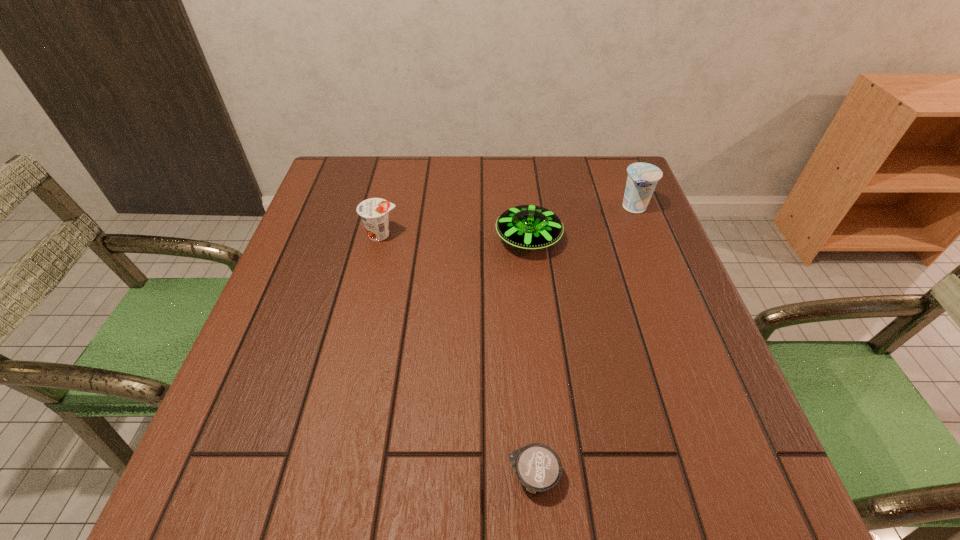
Where is `free location located on the back of the shortest object`? Image resolution: width=960 pixels, height=540 pixels. free location located on the back of the shortest object is located at coordinates coord(521,326).

Identify the location of object situated at the far edge. The width and height of the screenshot is (960, 540). (642, 179).

I want to click on object that is positioned at the near edge, so click(538, 467).

Image resolution: width=960 pixels, height=540 pixels. I want to click on object that is at the left edge, so click(x=374, y=212).

Locate an element on the screen. object that is at the right edge is located at coordinates (642, 179).

Locate an element on the screen. object that is at the far right corner is located at coordinates (642, 179).

In the image, there is a desktop. At what (x,y) coordinates should I click in order to perform the action: click on vacant area at the far edge. Please return your answer as a coordinate pair (x, y). Looking at the image, I should click on (528, 180).

In the image, there is a desktop. At what (x,y) coordinates should I click in order to perform the action: click on free space at the left edge. Please return your answer as a coordinate pair (x, y). This screenshot has height=540, width=960. Looking at the image, I should click on (275, 316).

Locate an element on the screen. The width and height of the screenshot is (960, 540). vacant space at the right edge of the desktop is located at coordinates (691, 386).

Identify the location of vacant space at the far left corner of the desktop. This screenshot has height=540, width=960. (373, 180).